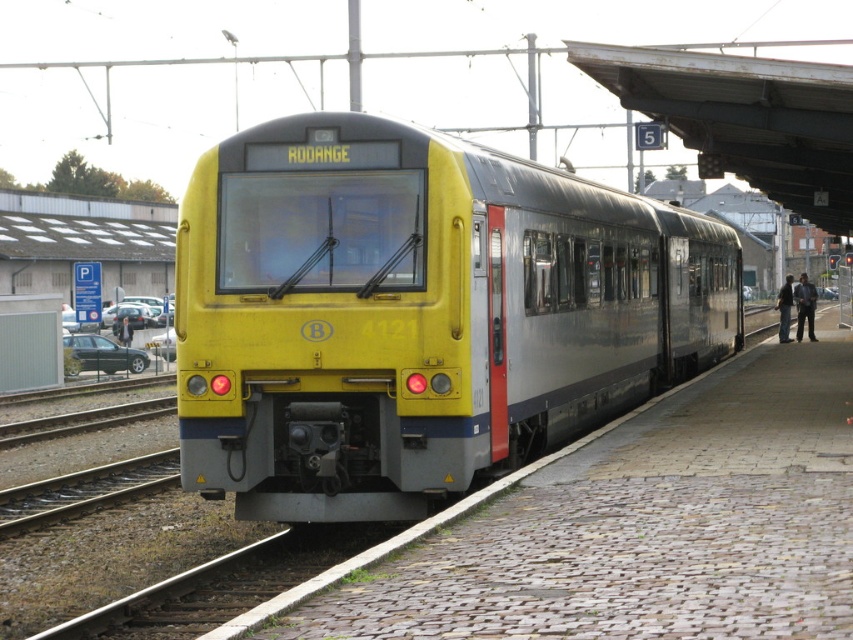
Question: Can you confirm if yellow matte train at center is positioned to the left of cobblestone platform at center?

Choices:
 (A) yes
 (B) no

Answer: (A)

Question: Does yellow matte train at center have a smaller size compared to cobblestone platform at center?

Choices:
 (A) yes
 (B) no

Answer: (B)

Question: Can you confirm if yellow matte train at center is smaller than cobblestone platform at center?

Choices:
 (A) no
 (B) yes

Answer: (A)

Question: Which of the following is the farthest from the observer?

Choices:
 (A) (676, 438)
 (B) (268, 323)

Answer: (A)